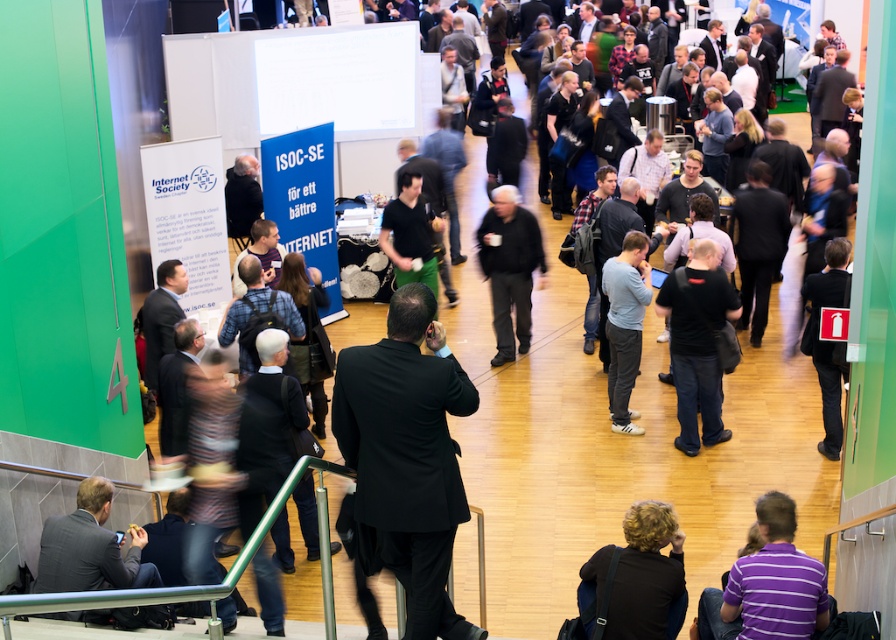
You are standing at the top of the staircase and want to greet both the person wearing the purple striped shirt at lower right and the person wearing the black matte shirt at center. Which person should you approach first to minimize the distance walked?

You should approach the purple striped shirt at lower right first because it is closer to the viewer, meaning it is nearer to your current position at the top of the staircase compared to the black matte shirt at center.